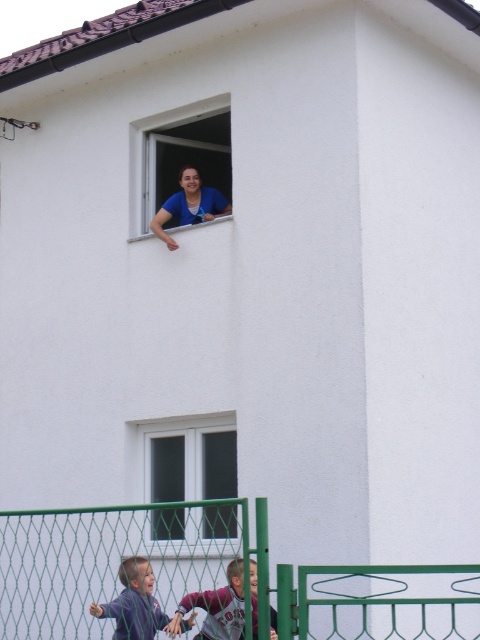
Does white plastic window at lower center lie in front of blue fabric at upper center?

Yes, white plastic window at lower center is in front of blue fabric at upper center.

Can you confirm if white plastic window at lower center is smaller than blue fabric at upper center?

Actually, white plastic window at lower center might be larger than blue fabric at upper center.

Between point (204, 522) and point (213, 211), which one is positioned in front?

Point (204, 522)

In order to click on white plastic window at lower center in this screenshot , I will do `click(190, 461)`.

Can you confirm if white plastic window at lower center is positioned above transparent glass window at upper center?

No, white plastic window at lower center is not above transparent glass window at upper center.

Can you confirm if white plastic window at lower center is positioned to the left of transparent glass window at upper center?

No, white plastic window at lower center is not to the left of transparent glass window at upper center.

Between point (237, 490) and point (162, 161), which one is positioned in front?

Point (237, 490) is in front.

Where is `white plastic window at lower center`? Image resolution: width=480 pixels, height=640 pixels. white plastic window at lower center is located at coordinates (190, 461).

Can you confirm if maroon jersey at lower center is smaller than light brown hair at lower left?

Correct, maroon jersey at lower center occupies less space than light brown hair at lower left.

Between maroon jersey at lower center and light brown hair at lower left, which one has less height?

With less height is maroon jersey at lower center.

Measure the distance between point (241, 630) and camera.

14.67 meters

I want to click on maroon jersey at lower center, so click(x=216, y=608).